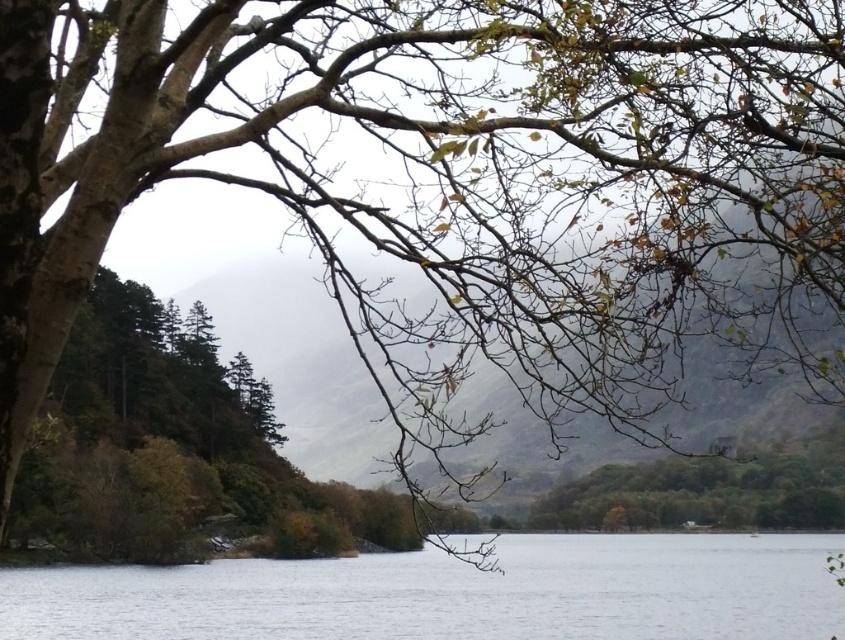
You are an artist planning to paint this landscape. You want to ensure the transparent water at center and the green matte tree at lower right are proportionally accurate. Which object should you paint first to maintain the correct size relationship, and why?

You should paint the transparent water at center first because it is larger in size than the green matte tree at lower right, so starting with the larger area ensures proper scaling before detailing the smaller element.

You are standing in the serene natural landscape scene with the calm lake and the tree branches in the foreground. If you were to walk towards the two points marked in the image, which point would you reach first, point (37,604) or point (750,493)?

You would reach point (37,604) first because it is closer to you than point (750,493), which is further away.